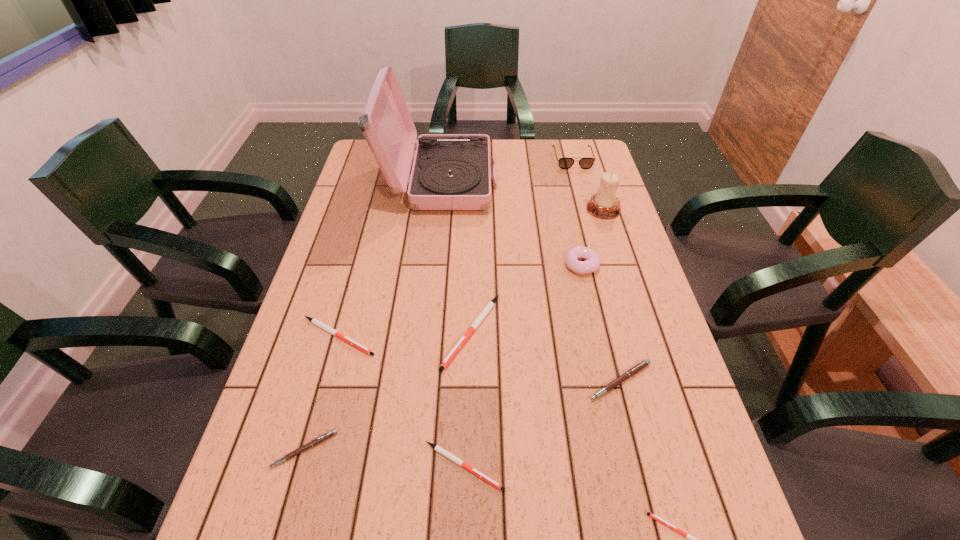
The image size is (960, 540). In order to click on object positioned at the far left corner in this screenshot , I will do tap(450, 171).

Where is `object that is at the far right corner`? The image size is (960, 540). object that is at the far right corner is located at coordinates (564, 163).

The width and height of the screenshot is (960, 540). In order to click on vacant region at the left edge of the desktop in this screenshot , I will do click(333, 284).

At what (x,y) coordinates should I click in order to perform the action: click on vacant space at the right edge of the desktop. Please return your answer as a coordinate pair (x, y). Looking at the image, I should click on (627, 418).

In the image, there is a desktop. Where is `vacant region at the far left corner`? Image resolution: width=960 pixels, height=540 pixels. vacant region at the far left corner is located at coordinates (380, 174).

Identify the location of free space between the tallest object and the third smallest white pen. (390, 259).

At what (x,y) coordinates should I click in order to perform the action: click on free space between the third biggest white pen and the black spectacles. Please return your answer as a coordinate pair (x, y). Looking at the image, I should click on (518, 313).

You are a GUI agent. You are given a task and a screenshot of the screen. Output one action in this format:
    pyautogui.click(x=<x>, y=<y>)
    Task: Click on the empty space between the record player and the leftmost white pen
    
    Given the screenshot: What is the action you would take?
    pyautogui.click(x=390, y=259)

At what (x,y) coordinates should I click in order to perform the action: click on blank region between the doughnut and the record player. Please return your answer as a coordinate pair (x, y). The height and width of the screenshot is (540, 960). Looking at the image, I should click on (511, 223).

Find the location of a particular element. unoccupied position between the record player and the biggest white pen is located at coordinates (456, 256).